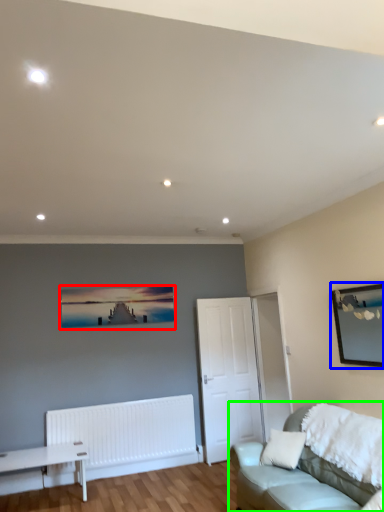
Question: Which object is the farthest from picture frame (highlighted by a red box)? Choose among these: picture frame (highlighted by a blue box) or studio couch (highlighted by a green box).

Choices:
 (A) picture frame
 (B) studio couch

Answer: (A)